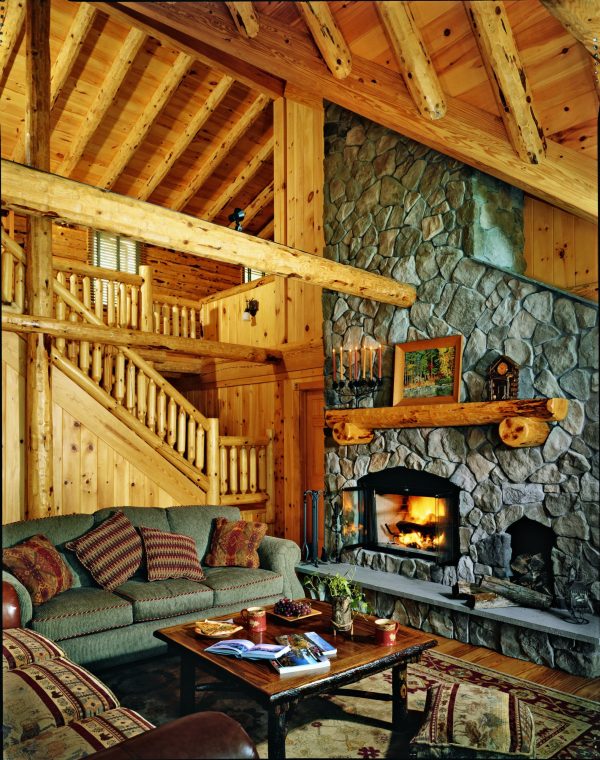
Locate an element on the screen. This screenshot has height=760, width=600. dark brown and maroon striped pillows is located at coordinates (124, 553), (170, 553).